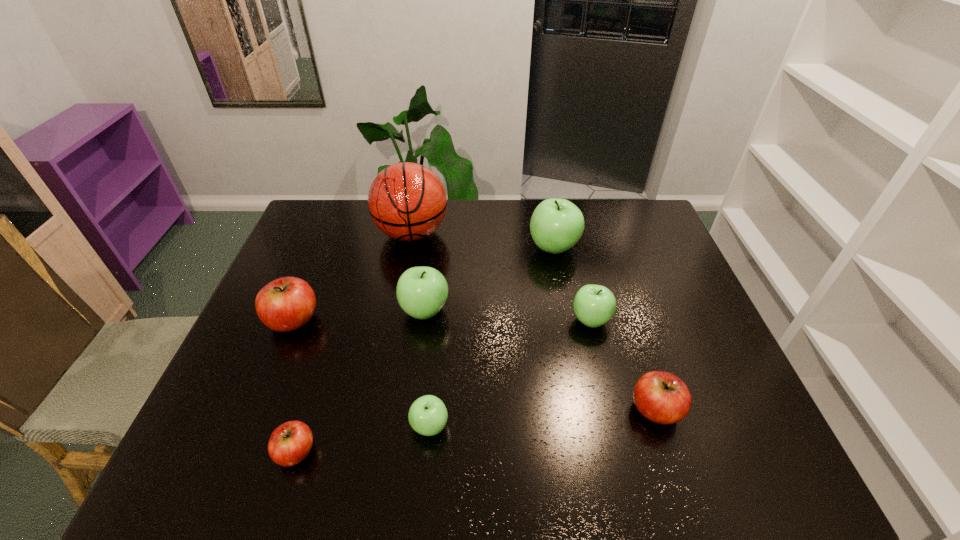
The width and height of the screenshot is (960, 540). I want to click on basketball, so click(x=407, y=201).

Find the location of a particular element. This screenshot has height=540, width=960. the farthest green apple is located at coordinates 556,225.

Identify the location of the second tallest object. (556, 225).

Identify the location of the second biggest green apple. (421, 292).

Locate an element on the screen. The height and width of the screenshot is (540, 960). the farthest red apple is located at coordinates [x=285, y=304].

This screenshot has height=540, width=960. Find the location of `the biggest red apple`. the biggest red apple is located at coordinates tap(285, 304).

You are a GUI agent. You are given a task and a screenshot of the screen. Output one action in this format:
    pyautogui.click(x=<x>, y=<y>)
    Task: Click on the second smallest green apple
    This screenshot has width=960, height=540.
    Given the screenshot: What is the action you would take?
    pyautogui.click(x=594, y=305)

Where is `the second smallest red apple`? This screenshot has height=540, width=960. the second smallest red apple is located at coordinates (663, 398).

Find the location of a particular element. The image size is (960, 540). the smallest green apple is located at coordinates (427, 415).

What are the coordinates of `the second apple from left to right` in the screenshot? It's located at (290, 443).